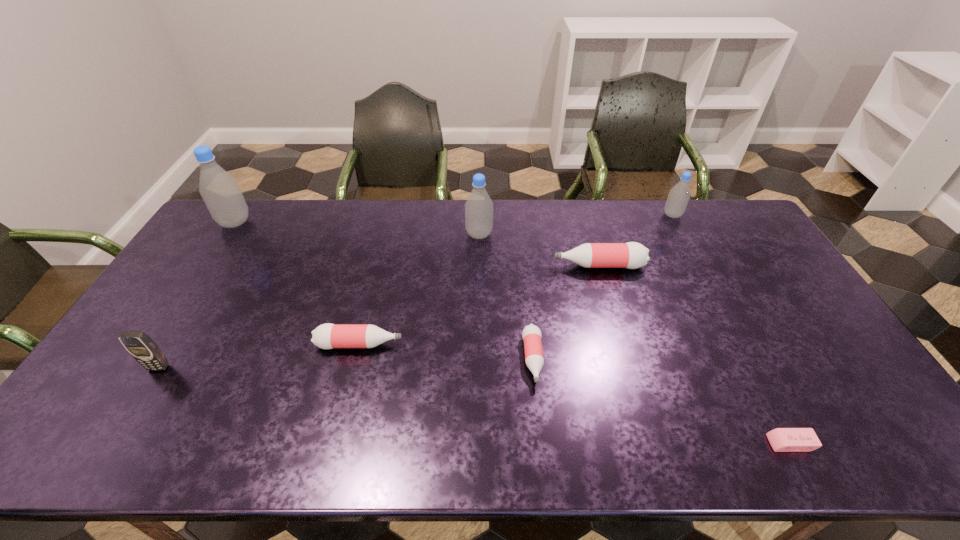
Locate an element on the screen. the second closest pink bottle to the eraser is located at coordinates (631, 255).

Find the location of a particular element. The height and width of the screenshot is (540, 960). the closest pink bottle to the pink eraser is located at coordinates (531, 334).

The image size is (960, 540). Find the location of `vacant space that satisfies the following two spatial constraints: 1. on the front side of the second biggest gray bottle; 2. on the left side of the biggest gray bottle`. vacant space that satisfies the following two spatial constraints: 1. on the front side of the second biggest gray bottle; 2. on the left side of the biggest gray bottle is located at coordinates (228, 234).

Identify the location of vacant region that satisfies the following two spatial constraints: 1. on the front side of the smallest gray bottle; 2. with the cap open on the third object from right to left. This screenshot has height=540, width=960. (699, 266).

I want to click on free spot that satisfies the following two spatial constraints: 1. with the cap open on the sixth object from right to left; 2. on the right side of the eraser, so click(x=336, y=443).

Image resolution: width=960 pixels, height=540 pixels. Find the location of `free space that satisfies the following two spatial constraints: 1. on the back side of the eraser; 2. with the cap open on the sixth tallest object`. free space that satisfies the following two spatial constraints: 1. on the back side of the eraser; 2. with the cap open on the sixth tallest object is located at coordinates (738, 345).

At what (x,y) coordinates should I click in order to perform the action: click on free space that satisfies the following two spatial constraints: 1. with the cap open on the pink eraser; 2. on the left side of the second bottle from left to right. Please return your answer as a coordinate pair (x, y). The width and height of the screenshot is (960, 540). Looking at the image, I should click on point(336,443).